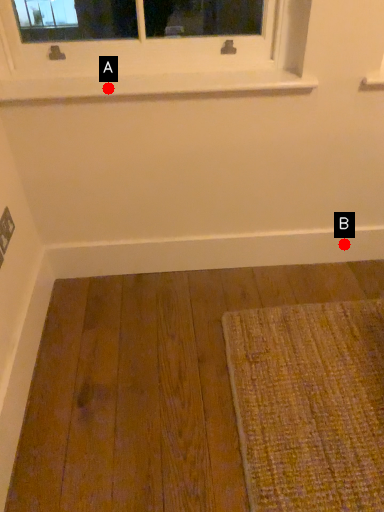
Question: Two points are circled on the image, labeled by A and B beside each circle. Among these points, which one is farthest from the camera?

Choices:
 (A) A is further
 (B) B is further

Answer: (B)